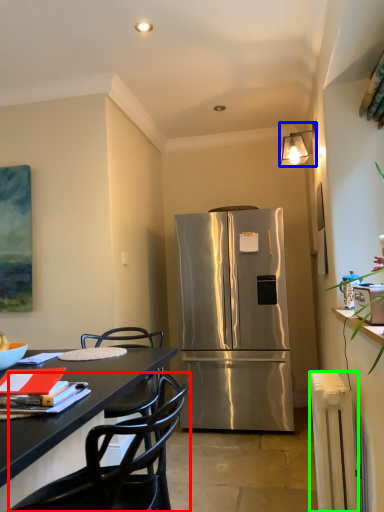
Question: Which is farther away from chair (highlighted by a red box)? lamp (highlighted by a blue box) or radiator (highlighted by a green box)?

Choices:
 (A) lamp
 (B) radiator

Answer: (A)